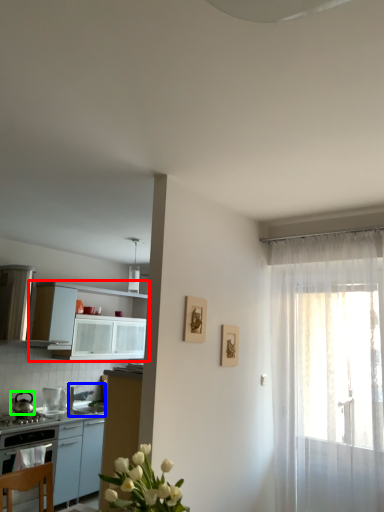
Question: Which object is positioned farthest from cabinetry (highlighted by a red box)? Select from sink (highlighted by a blue box) and kitchen appliance (highlighted by a green box).

Choices:
 (A) sink
 (B) kitchen appliance

Answer: (B)